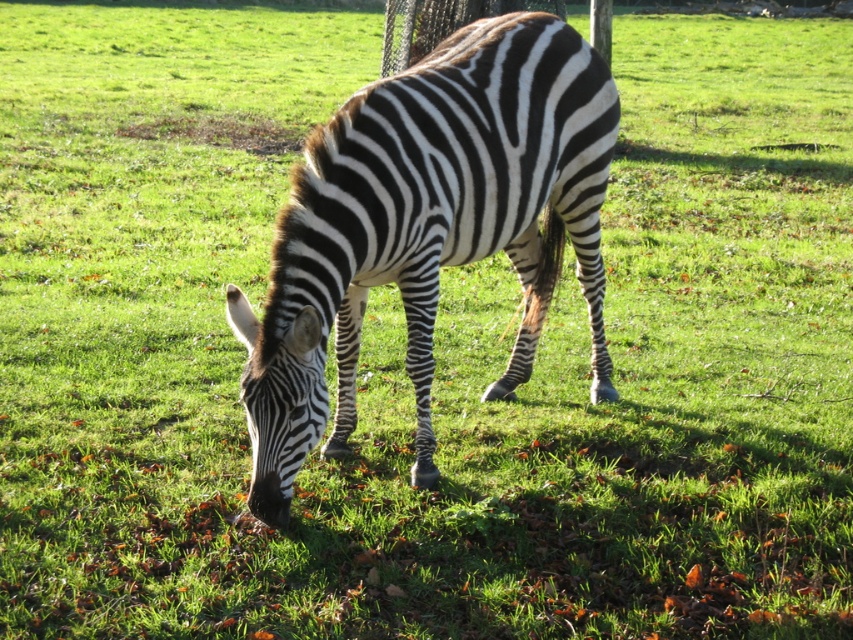
Question: Does black and white striped zebra at center appear on the left side of black and white striped zebra head at lower center?

Choices:
 (A) no
 (B) yes

Answer: (A)

Question: Is black and white striped zebra at center smaller than black and white striped zebra head at lower center?

Choices:
 (A) yes
 (B) no

Answer: (B)

Question: Can you confirm if black and white striped zebra at center is positioned to the left of black and white striped zebra head at lower center?

Choices:
 (A) yes
 (B) no

Answer: (B)